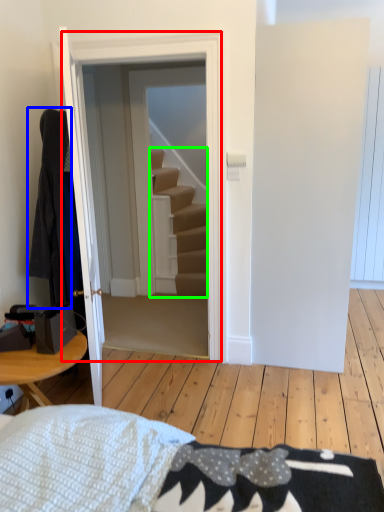
Question: Which is nearer to the door (highlighted by a red box)? robe (highlighted by a blue box) or stairs (highlighted by a green box).

Choices:
 (A) robe
 (B) stairs

Answer: (A)